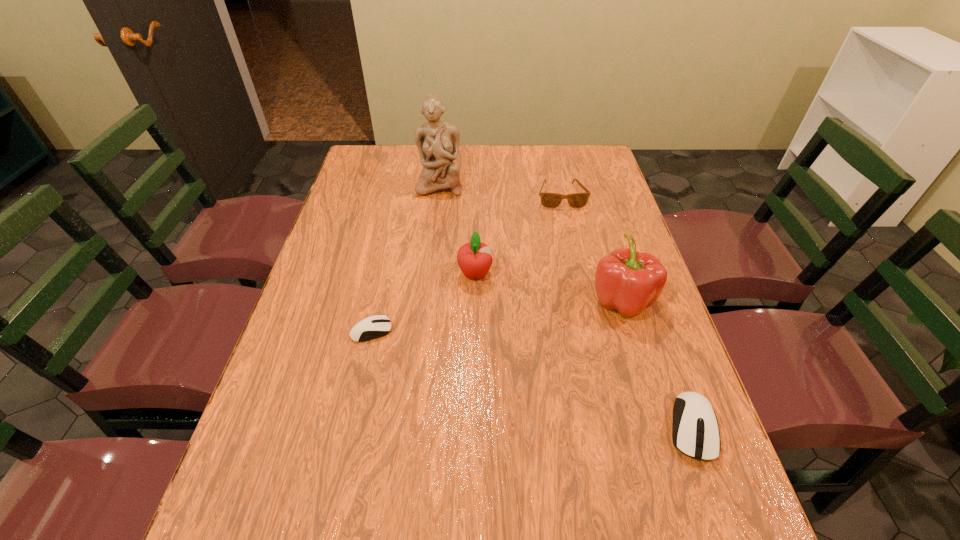
Locate an element on the screen. free location located 0.200m on the left of the taller mouse is located at coordinates (567, 427).

This screenshot has height=540, width=960. Find the location of `free space located on the frames of the sunglasses`. free space located on the frames of the sunglasses is located at coordinates (583, 291).

Where is `vacant space located on the front-facing side of the figurine`? This screenshot has height=540, width=960. vacant space located on the front-facing side of the figurine is located at coordinates (429, 269).

The width and height of the screenshot is (960, 540). Identify the location of vacant space located on the right of the third object from left to right. (543, 274).

Find the location of a particular element. vacant region located on the front of the second tallest object is located at coordinates [657, 414].

Where is `object present at the far edge`? object present at the far edge is located at coordinates (438, 142).

Locate an element on the screen. The width and height of the screenshot is (960, 540). object located at the near edge is located at coordinates (695, 432).

What are the coordinates of `object that is at the left edge` in the screenshot? It's located at (375, 326).

I want to click on mouse situated at the right edge, so click(x=695, y=432).

At what (x,y) coordinates should I click in order to perform the action: click on sunglasses that is at the right edge. Please return your answer as a coordinate pair (x, y). Image resolution: width=960 pixels, height=540 pixels. Looking at the image, I should click on (549, 200).